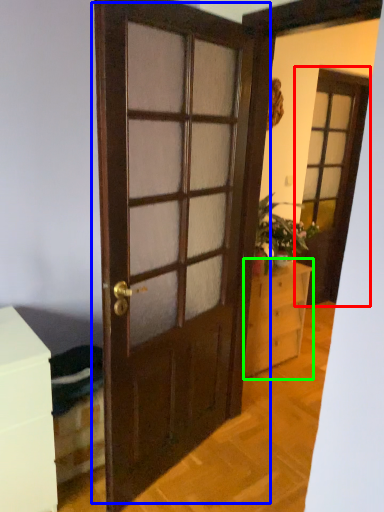
Question: Which object is the closest to the screen door (highlighted by a red box)? Choose among these: door (highlighted by a blue box) or chest of drawers (highlighted by a green box).

Choices:
 (A) door
 (B) chest of drawers

Answer: (B)